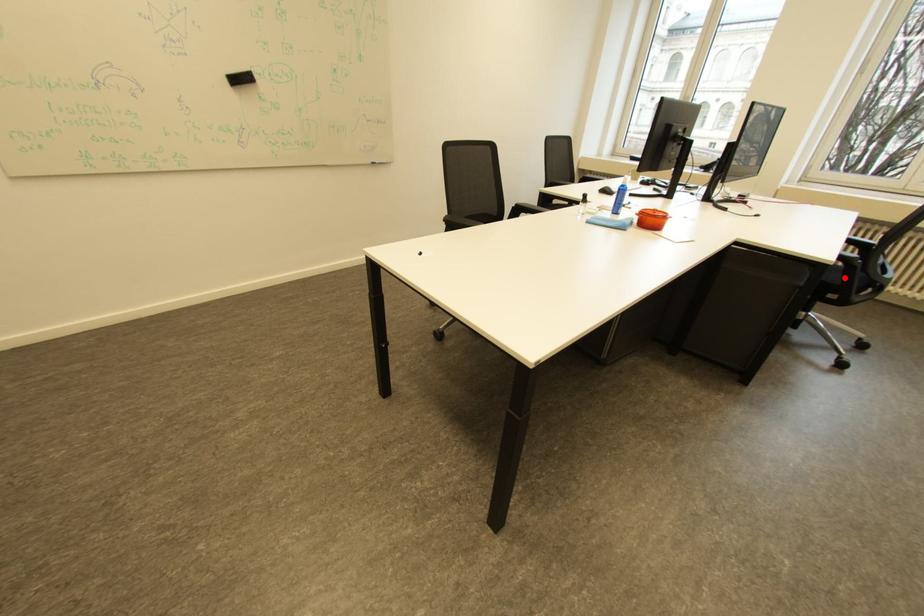
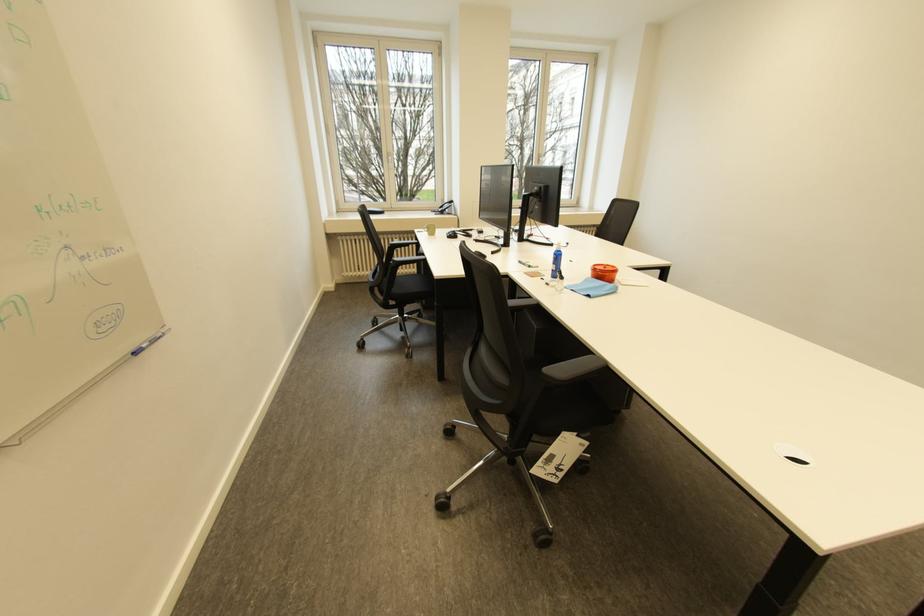
Question: I am providing you with two images of the same scene from different viewpoints. A red point is marked on the first image. Is the red point's position out of view in image 2?

Choices:
 (A) Yes
 (B) No

Answer: (A)